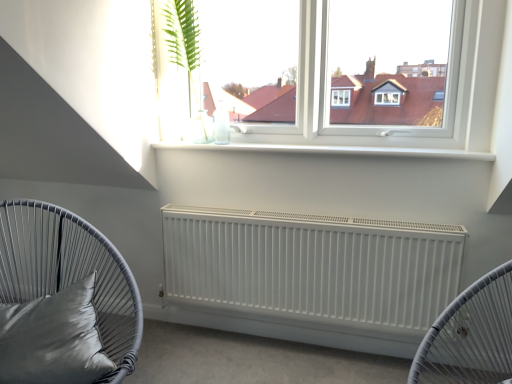
Question: Can we say matte gray cushion at left lies outside satin gray pillow at lower left?

Choices:
 (A) yes
 (B) no

Answer: (A)

Question: Is matte gray cushion at left not near satin gray pillow at lower left?

Choices:
 (A) yes
 (B) no

Answer: (B)

Question: From a real-world perspective, is matte gray cushion at left on top of satin gray pillow at lower left?

Choices:
 (A) no
 (B) yes

Answer: (A)

Question: Is matte gray cushion at left bigger than satin gray pillow at lower left?

Choices:
 (A) no
 (B) yes

Answer: (B)

Question: Is matte gray cushion at left taller than satin gray pillow at lower left?

Choices:
 (A) no
 (B) yes

Answer: (B)

Question: From the image's perspective, does matte gray cushion at left appear higher than satin gray pillow at lower left?

Choices:
 (A) yes
 (B) no

Answer: (B)

Question: Is green leafy plant at upper center with matte gray cushion at left?

Choices:
 (A) yes
 (B) no

Answer: (B)

Question: Considering the relative sizes of green leafy plant at upper center and matte gray cushion at left in the image provided, is green leafy plant at upper center bigger than matte gray cushion at left?

Choices:
 (A) yes
 (B) no

Answer: (B)

Question: Can you confirm if green leafy plant at upper center is smaller than matte gray cushion at left?

Choices:
 (A) yes
 (B) no

Answer: (A)

Question: From a real-world perspective, is green leafy plant at upper center positioned over matte gray cushion at left based on gravity?

Choices:
 (A) no
 (B) yes

Answer: (B)

Question: From the image's perspective, is green leafy plant at upper center under matte gray cushion at left?

Choices:
 (A) yes
 (B) no

Answer: (B)

Question: Is green leafy plant at upper center positioned before matte gray cushion at left?

Choices:
 (A) yes
 (B) no

Answer: (B)

Question: Is the depth of white matte radiator at center less than that of satin gray pillow at lower left?

Choices:
 (A) no
 (B) yes

Answer: (A)